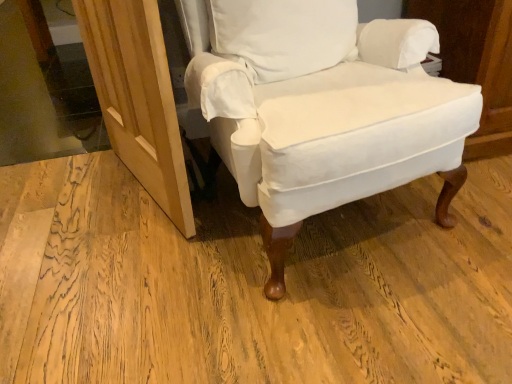
Where is `vacant position to the left of natural wood screen door at lower left`? Image resolution: width=512 pixels, height=384 pixels. vacant position to the left of natural wood screen door at lower left is located at coordinates (65, 193).